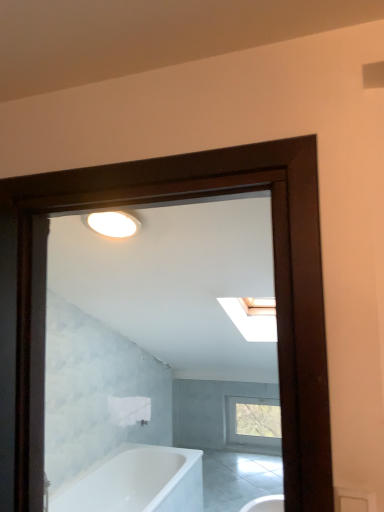
The height and width of the screenshot is (512, 384). Describe the element at coordinates (253, 421) in the screenshot. I see `clear glass window at center` at that location.

The height and width of the screenshot is (512, 384). Identify the location of clear glass window at center. [x=253, y=421].

I want to click on white glossy bathtub at lower left, so click(136, 482).

What do you see at coordinates (136, 482) in the screenshot? I see `white glossy bathtub at lower left` at bounding box center [136, 482].

Locate an element on the screen. clear glass window at center is located at coordinates (253, 421).

Does clear glass window at center appear on the right side of white glossy bathtub at lower left?

Indeed, clear glass window at center is positioned on the right side of white glossy bathtub at lower left.

Which object is further away from the camera, clear glass window at center or white glossy bathtub at lower left?

clear glass window at center is behind.

Between point (250, 426) and point (128, 489), which one is positioned in front?

The point (128, 489) is more forward.

From the image's perspective, which one is positioned lower, clear glass window at center or white glossy bathtub at lower left?

clear glass window at center is shown below in the image.

From a real-world perspective, who is located higher, clear glass window at center or white glossy bathtub at lower left?

In real-world perspective, clear glass window at center is above.

In terms of width, does clear glass window at center look wider or thinner when compared to white glossy bathtub at lower left?

Clearly, clear glass window at center has less width compared to white glossy bathtub at lower left.

Is clear glass window at center taller or shorter than white glossy bathtub at lower left?

Clearly, clear glass window at center is shorter compared to white glossy bathtub at lower left.

Who is smaller, clear glass window at center or white glossy bathtub at lower left?

clear glass window at center is smaller.

Can we say clear glass window at center lies outside white glossy bathtub at lower left?

Absolutely, clear glass window at center is external to white glossy bathtub at lower left.

From the picture: Is clear glass window at center not close to white glossy bathtub at lower left?

Yes, clear glass window at center and white glossy bathtub at lower left are quite far apart.

Does clear glass window at center turn towards white glossy bathtub at lower left?

Yes.

How different are the orientations of clear glass window at center and white glossy bathtub at lower left in degrees?

There is a 90.6-degree angle between the facing directions of clear glass window at center and white glossy bathtub at lower left.

At what (x,y) coordinates should I click in order to perform the action: click on bathtub in front of the clear glass window at center. Please return your answer as a coordinate pair (x, y). This screenshot has height=512, width=384. Looking at the image, I should click on (136, 482).

Can you confirm if white glossy bathtub at lower left is positioned to the left of clear glass window at center?

Correct, you'll find white glossy bathtub at lower left to the left of clear glass window at center.

Which object is further away from the camera taking this photo, white glossy bathtub at lower left or clear glass window at center?

clear glass window at center is further away from the camera.

Is point (140, 450) positioned before point (241, 439)?

Yes.

From the image's perspective, is white glossy bathtub at lower left below clear glass window at center?

No, from the image's perspective, white glossy bathtub at lower left is not beneath clear glass window at center.

From a real-world perspective, relative to clear glass window at center, is white glossy bathtub at lower left vertically above or below?

white glossy bathtub at lower left is below clear glass window at center.

Which object is wider, white glossy bathtub at lower left or clear glass window at center?

white glossy bathtub at lower left is wider.

Considering the relative sizes of white glossy bathtub at lower left and clear glass window at center in the image provided, is white glossy bathtub at lower left shorter than clear glass window at center?

No.

Looking at the image, does white glossy bathtub at lower left seem bigger or smaller compared to clear glass window at center?

Considering their sizes, white glossy bathtub at lower left takes up more space than clear glass window at center.

Is white glossy bathtub at lower left inside or outside of clear glass window at center?

white glossy bathtub at lower left exists outside the volume of clear glass window at center.

Is the surface of white glossy bathtub at lower left in direct contact with clear glass window at center?

No, white glossy bathtub at lower left is not in contact with clear glass window at center.

Could you tell me if white glossy bathtub at lower left is facing clear glass window at center?

No, white glossy bathtub at lower left does not turn towards clear glass window at center.

Where is `window lying on the right of white glossy bathtub at lower left`? The image size is (384, 512). window lying on the right of white glossy bathtub at lower left is located at coordinates 253,421.

Where is `bathtub in front of the clear glass window at center`? Image resolution: width=384 pixels, height=512 pixels. bathtub in front of the clear glass window at center is located at coordinates (136, 482).

This screenshot has height=512, width=384. What are the coordinates of `window below the white glossy bathtub at lower left (from the image's perspective)` in the screenshot? It's located at (253, 421).